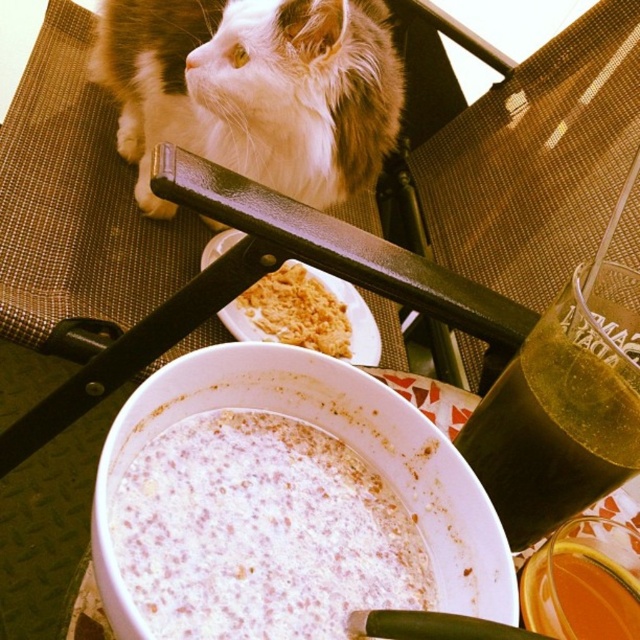
Which of these two, green translucent glass at upper right or white crumbly at center, stands shorter?

With less height is green translucent glass at upper right.

Does point (589, 419) lie behind point (204, 246)?

No, it is not.

Does point (483, 419) lie in front of point (333, 276)?

Yes.

At what (x,y) coordinates should I click in order to perform the action: click on green translucent glass at upper right. Please return your answer as a coordinate pair (x, y). Looking at the image, I should click on (561, 412).

Does green translucent glass at upper right have a larger size compared to translucent amber liquid at lower right?

Yes, green translucent glass at upper right is bigger than translucent amber liquid at lower right.

Find the location of `green translucent glass at upper right`. green translucent glass at upper right is located at coordinates (561, 412).

You are a GUI agent. You are given a task and a screenshot of the screen. Output one action in this format:
    pyautogui.click(x=<x>, y=<y>)
    Task: Click on the green translucent glass at upper right
    This screenshot has height=640, width=640.
    Given the screenshot: What is the action you would take?
    pyautogui.click(x=561, y=412)

Where is `green translucent glass at upper right`? green translucent glass at upper right is located at coordinates (561, 412).

In the scene shown: Which is more to the left, black plastic chair at upper center or white crumbly at center?

white crumbly at center is more to the left.

Does black plastic chair at upper center appear on the left side of white crumbly at center?

Incorrect, black plastic chair at upper center is not on the left side of white crumbly at center.

Who is more forward, [435,308] or [250,337]?

Point [435,308] is in front.

Where is `black plastic chair at upper center`? Image resolution: width=640 pixels, height=640 pixels. black plastic chair at upper center is located at coordinates (257, 278).